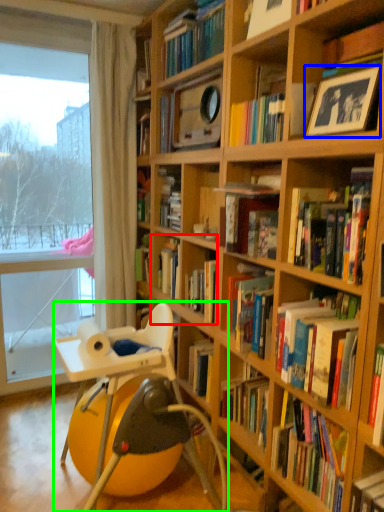
Question: Based on their relative distances, which object is farther from book (highlighted by a red box)? Choose from paperback book (highlighted by a blue box) and chair (highlighted by a green box).

Choices:
 (A) paperback book
 (B) chair

Answer: (A)